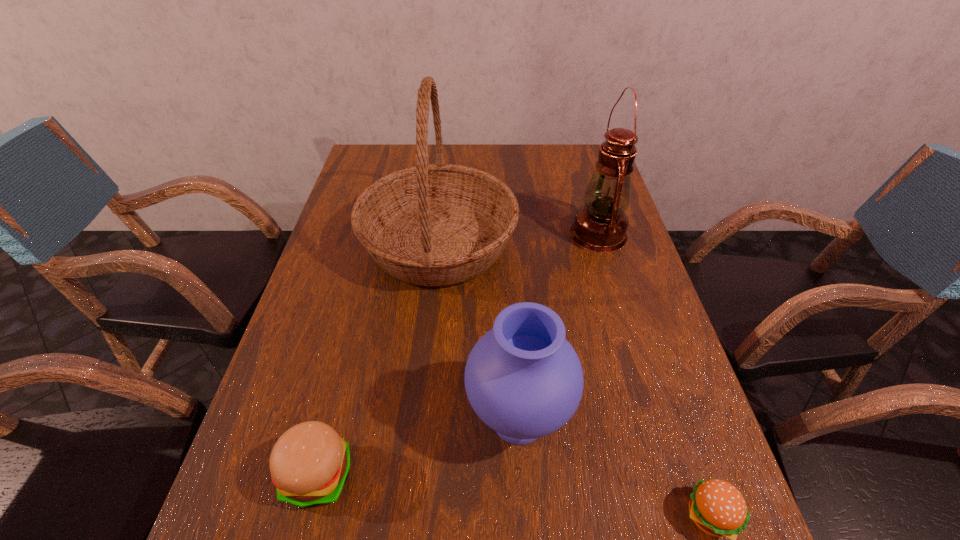
This screenshot has width=960, height=540. What are the coordinates of `basket` in the screenshot? It's located at (440, 224).

Where is `oil lamp`? The image size is (960, 540). oil lamp is located at coordinates (600, 226).

Image resolution: width=960 pixels, height=540 pixels. In order to click on the third tallest object in this screenshot , I will do `click(523, 379)`.

This screenshot has width=960, height=540. In order to click on the fourth tallest object in this screenshot , I will do `click(309, 464)`.

Image resolution: width=960 pixels, height=540 pixels. Identify the location of the taller hamburger. (309, 464).

I want to click on vacant position located 0.230m on the front of the basket, so click(424, 388).

You are a GUI agent. You are given a task and a screenshot of the screen. Output one action in this format:
    pyautogui.click(x=<x>, y=<y>)
    Task: Click on the vacant space located 0.350m on the front of the oil lamp
    
    Given the screenshot: What is the action you would take?
    pyautogui.click(x=638, y=369)

This screenshot has height=540, width=960. Find the location of `vacant space located on the right of the vase`. vacant space located on the right of the vase is located at coordinates (601, 420).

I want to click on vacant space situated 0.260m on the right of the taller hamburger, so click(498, 474).

I want to click on basket that is positioned at the left edge, so click(440, 224).